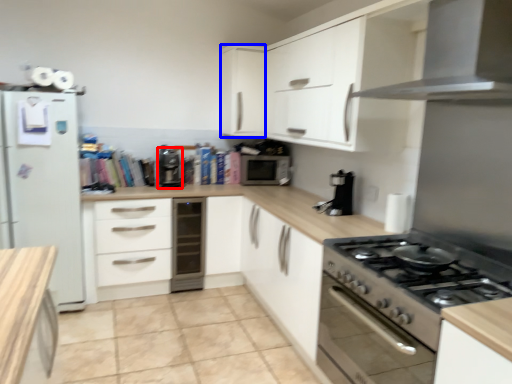
Question: Which object is closer to the camera taking this photo, coffee machine (highlighted by a red box) or cabinetry (highlighted by a blue box)?

Choices:
 (A) coffee machine
 (B) cabinetry

Answer: (A)